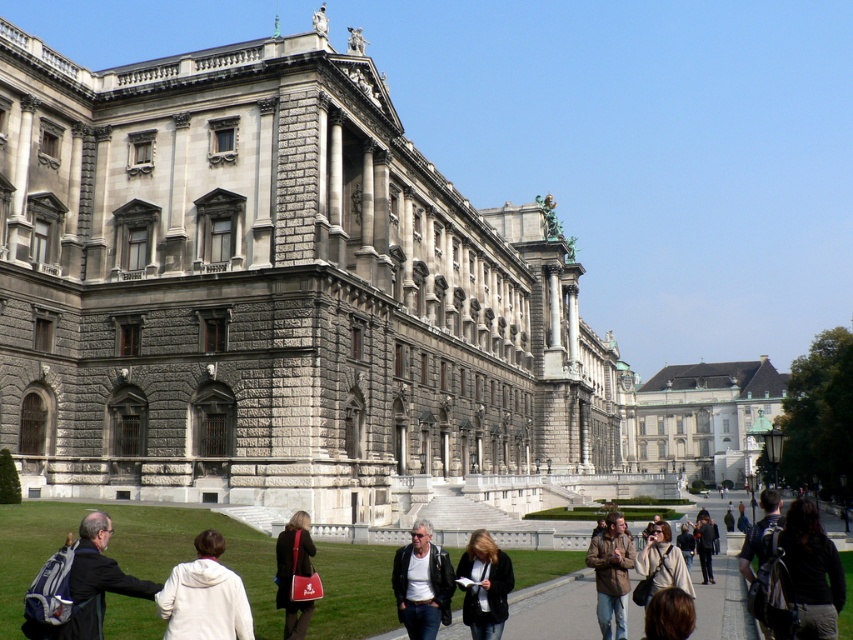
Question: Does dark gray suit at lower left lie behind brown leather jacket at lower right?

Choices:
 (A) no
 (B) yes

Answer: (A)

Question: Which of the following is the closest to the observer?

Choices:
 (A) green fabric backpack at lower right
 (B) black leather jacket at lower center
 (C) dark brown leather jacket at lower right
 (D) dark gray suit at lower left

Answer: (D)

Question: Which point is farther to the camera?

Choices:
 (A) dark brown leather jacket at center
 (B) concrete pathway at center
 (C) black leather jacket at lower center
 (D) gray stone building at center

Answer: (D)

Question: Does concrete pathway at center lie in front of dark brown hair at lower right?

Choices:
 (A) yes
 (B) no

Answer: (B)

Question: Can you confirm if concrete pathway at center is bigger than dark brown leather jacket at lower right?

Choices:
 (A) yes
 (B) no

Answer: (B)

Question: Which object appears closest to the camera in this image?

Choices:
 (A) white matte jacket at lower left
 (B) beige silk kimono at center
 (C) black leather jacket at lower center

Answer: (A)